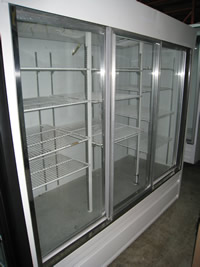
Where is `another fridge in background`? This screenshot has width=200, height=267. another fridge in background is located at coordinates (190, 154).